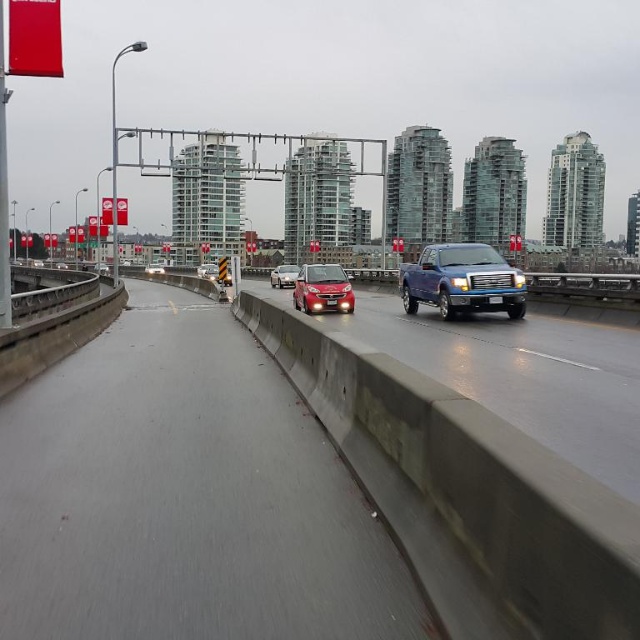
The height and width of the screenshot is (640, 640). Identify the location of satin red car at center. (323, 289).

Is point (305, 276) more distant than point (204, 273)?

No, it is not.

Is point (323, 276) in front of point (205, 262)?

Yes, point (323, 276) is in front of point (205, 262).

Identify the location of satin red car at center. The image size is (640, 640). (323, 289).

Is satin red car at center behind shiny silver sedan at center?

No, it is not.

Who is more forward, (333, 268) or (292, 284)?

Point (333, 268)

Describe the element at coordinates (323, 289) in the screenshot. I see `satin red car at center` at that location.

You are a GUI agent. You are given a task and a screenshot of the screen. Output one action in this format:
    pyautogui.click(x=<x>, y=<y>)
    Task: Click on the satin red car at center
    
    Given the screenshot: What is the action you would take?
    pyautogui.click(x=323, y=289)

Is metallic blue truck at center to the right of shiny silver sedan at center from the viewer's perspective?

Indeed, metallic blue truck at center is positioned on the right side of shiny silver sedan at center.

Which is below, metallic blue truck at center or shiny silver sedan at center?

metallic blue truck at center is below.

What do you see at coordinates (461, 280) in the screenshot? The image size is (640, 640). I see `metallic blue truck at center` at bounding box center [461, 280].

Locate an element on the screen. metallic blue truck at center is located at coordinates (461, 280).